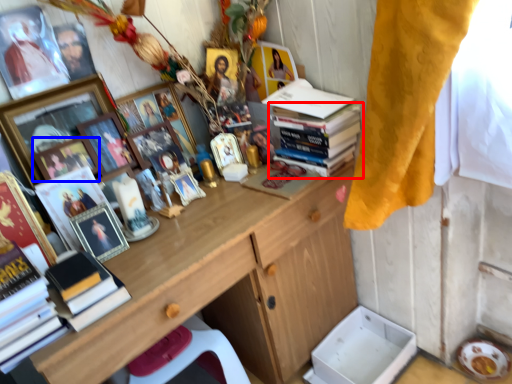
Question: Which object is further to the camera taking this photo, book (highlighted by a red box) or picture frame (highlighted by a blue box)?

Choices:
 (A) book
 (B) picture frame

Answer: (A)